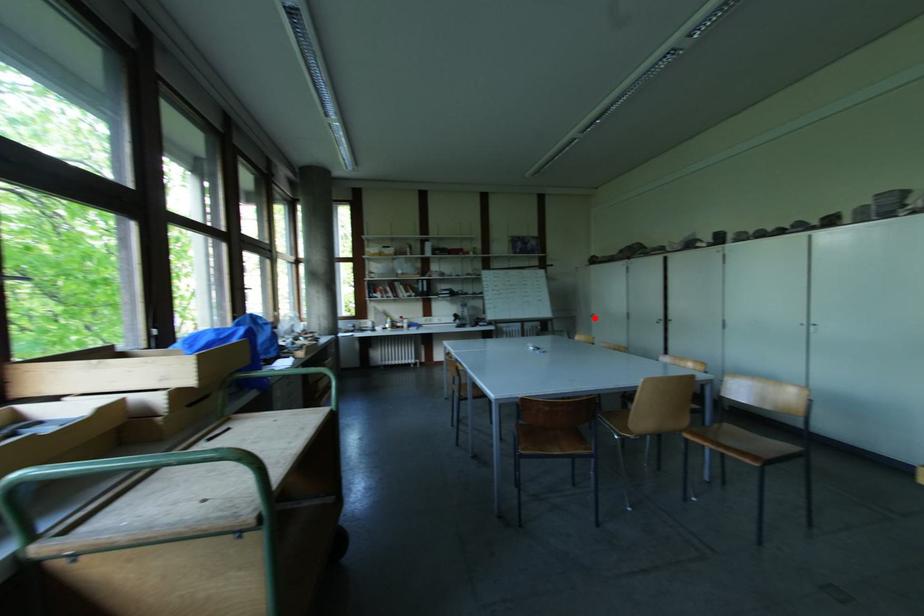
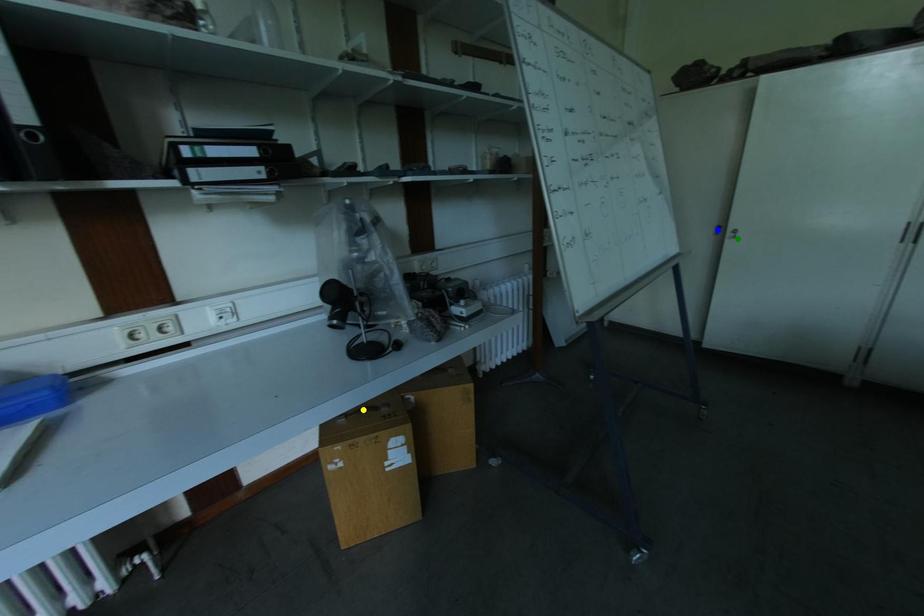
Question: I am providing you with two images of the same scene from different viewpoints. A red point is marked on the first image. You are given multiple points on the second image. Which point in image 2 represents the same 3d spot as the red point in image 1?

Choices:
 (A) blue point
 (B) yellow point
 (C) green point

Answer: (C)